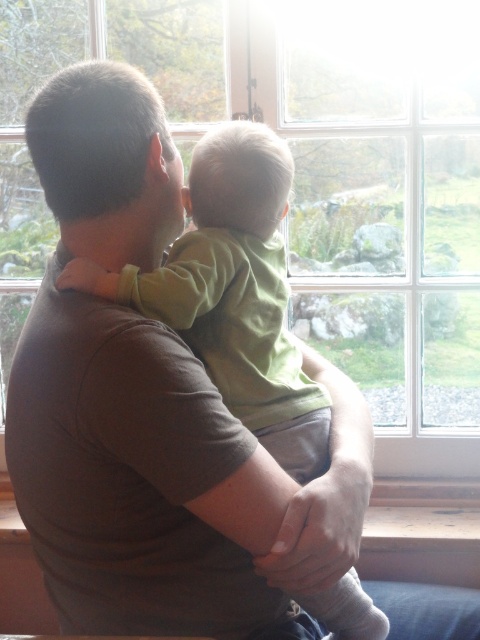
You are a photographer trying to capture the child in the image. The green matte shirt at center and the transparent glass window at center are both in your view. Which object is closer to you, the photographer?

The transparent glass window at center is closer to you than the green matte shirt at center because the green matte shirt at center is behind the transparent glass window at center.

You are a painter standing in front of the transparent glass window at center and the green matte shirt at center. You want to paint both objects but have limited canvas space. Which object should you prioritize painting first if you want to capture the entire object without cropping?

The green matte shirt at center should be prioritized first because its width is narrower than the transparent glass window at center, making it easier to fit on the canvas without cropping.

You are a painter standing in front of the transparent glass window at center and the green matte shirt at center. You want to paint the larger object first. Which object should you choose?

The transparent glass window at center is larger in size than the green matte shirt at center, so you should paint the transparent glass window at center first.